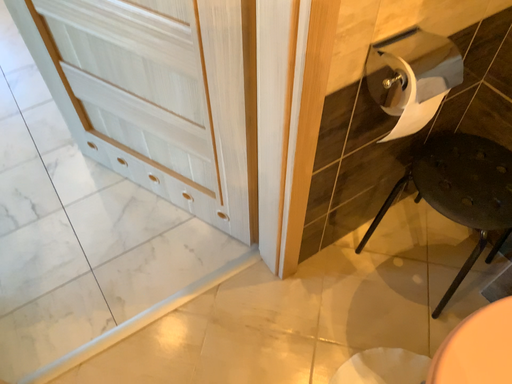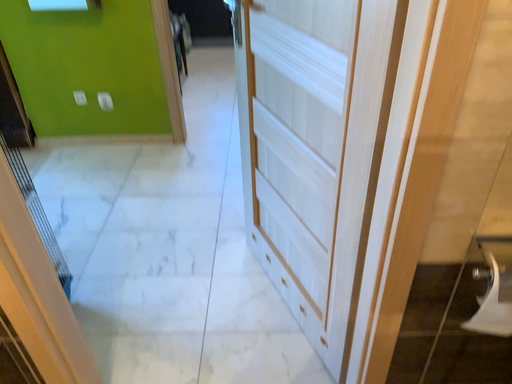
Question: Which way did the camera rotate in the video?

Choices:
 (A) rotated upward
 (B) rotated downward

Answer: (A)